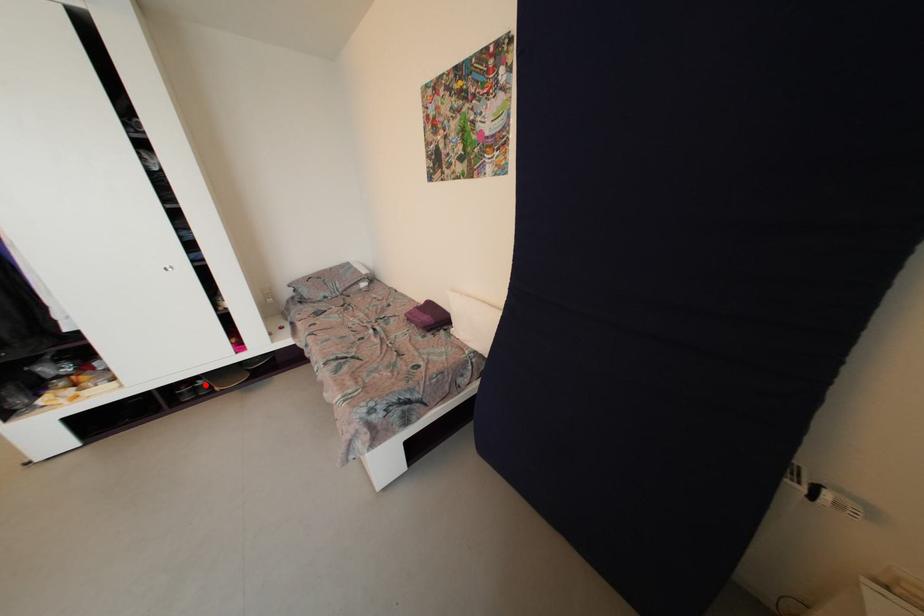
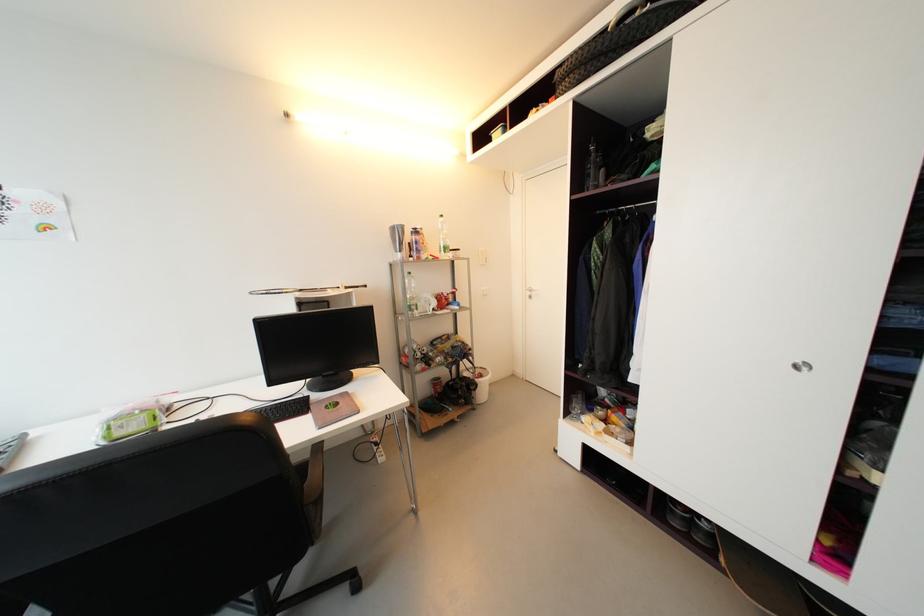
The point at the highlighted location is marked in the first image. Where is the corresponding point in the second image?

(710, 527)